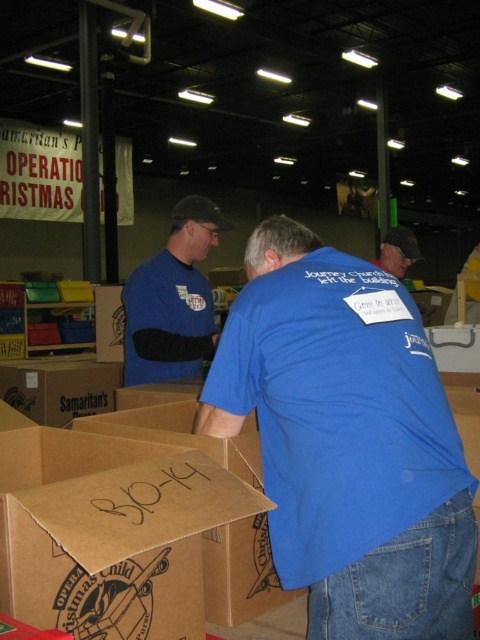
Is blue cotton shirt at center to the right of blue fabric shirt at center from the viewer's perspective?

Correct, you'll find blue cotton shirt at center to the right of blue fabric shirt at center.

Does blue cotton shirt at center appear over blue fabric shirt at center?

No.

Image resolution: width=480 pixels, height=640 pixels. What do you see at coordinates (348, 440) in the screenshot? I see `blue cotton shirt at center` at bounding box center [348, 440].

Locate an element on the screen. The image size is (480, 640). blue cotton shirt at center is located at coordinates (348, 440).